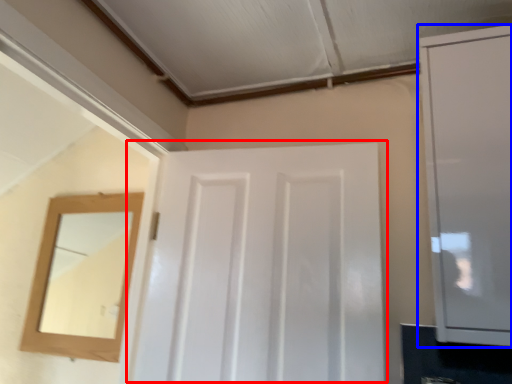
Question: Which object is further to the camera taking this photo, door (highlighted by a red box) or cabinetry (highlighted by a blue box)?

Choices:
 (A) door
 (B) cabinetry

Answer: (A)